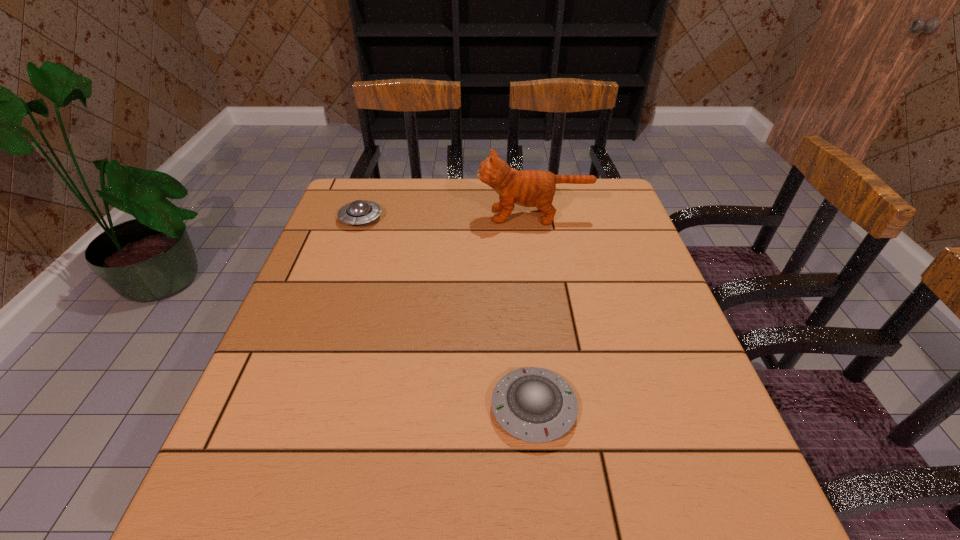
Identify the location of cat at the far edge. The image size is (960, 540). (530, 188).

This screenshot has height=540, width=960. I want to click on saucer located at the far edge, so click(x=357, y=212).

I want to click on object present at the left edge, so click(x=357, y=212).

Image resolution: width=960 pixels, height=540 pixels. In order to click on object that is at the right edge in this screenshot , I will do pos(530,188).

Find the location of `object that is at the far left corner`. object that is at the far left corner is located at coordinates (357, 212).

This screenshot has width=960, height=540. I want to click on object present at the far right corner, so click(x=530, y=188).

In order to click on free space at the far edge of the desktop in this screenshot , I will do `click(438, 184)`.

This screenshot has width=960, height=540. I want to click on free location at the near edge of the desktop, so click(x=608, y=525).

At what (x,y) coordinates should I click in order to perform the action: click on vacant area at the left edge. Please return your answer as a coordinate pair (x, y). Image resolution: width=960 pixels, height=540 pixels. Looking at the image, I should click on (300, 293).

In the image, there is a desktop. In order to click on vacant region at the right edge in this screenshot , I will do `click(646, 269)`.